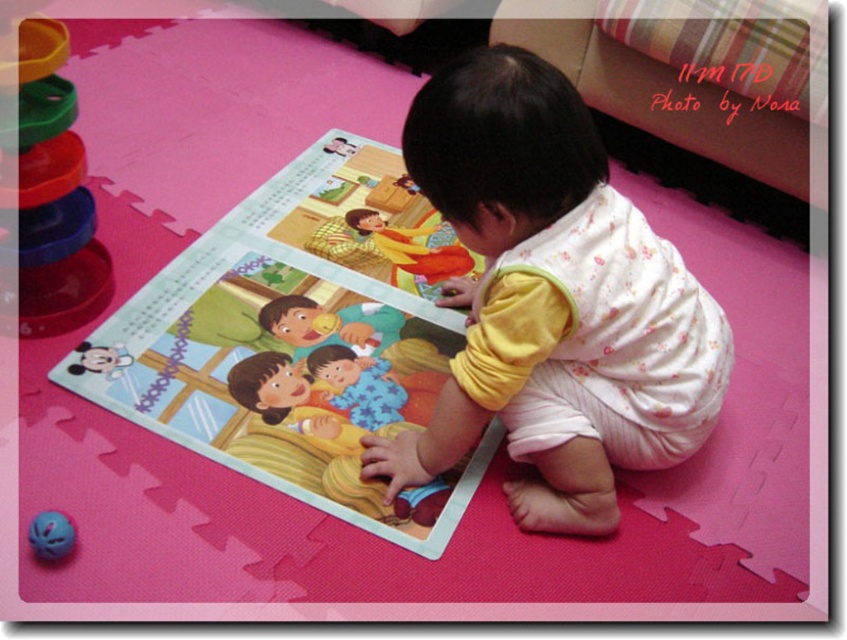
Which is behind, point (342, 470) or point (39, 116)?

Positioned behind is point (342, 470).

Identify the location of soft pastel pajamas at center. The height and width of the screenshot is (640, 847). (335, 422).

Which is more to the right, stacked plastic rings at left or purple rubber ball at lower left?

From the viewer's perspective, purple rubber ball at lower left appears more on the right side.

Is point (93, 304) positioned after point (64, 544)?

That is True.

Identify the location of stacked plastic rings at left. (53, 193).

At what (x,y) coordinates should I click in order to perform the action: click on stacked plastic rings at left. Please return your answer as a coordinate pair (x, y). The image size is (847, 640). Looking at the image, I should click on (x=53, y=193).

Can you confirm if pink foam mat at center is thinner than stacked plastic rings at left?

No, pink foam mat at center is not thinner than stacked plastic rings at left.

Measure the distance between point (209,573) and camera.

They are 3.52 feet apart.

Locate an element on the screen. pink foam mat at center is located at coordinates (475, 472).